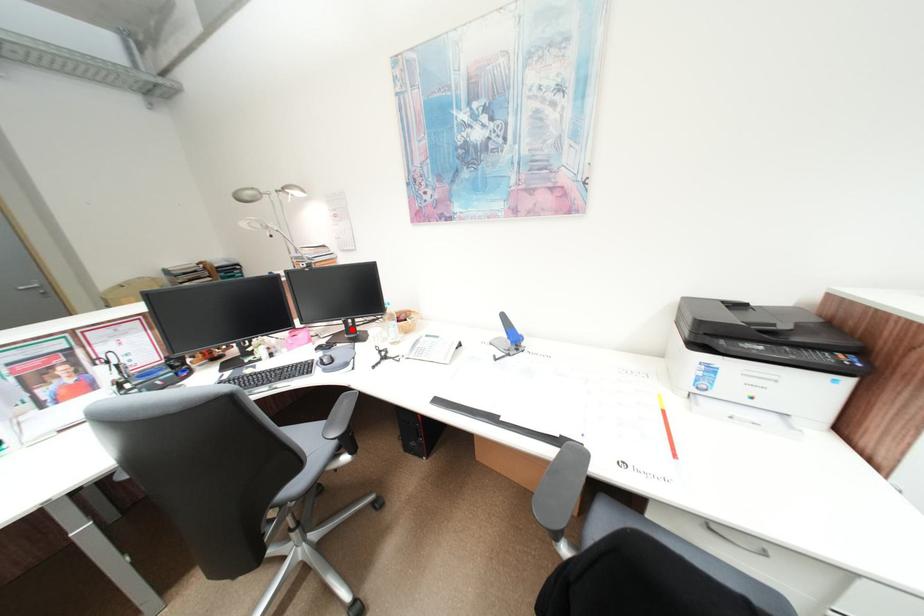
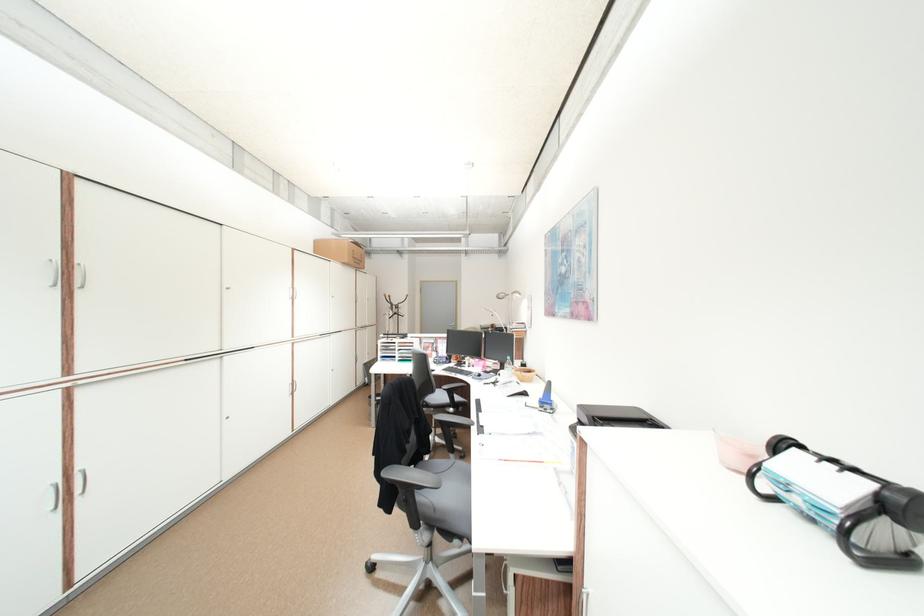
Question: I am providing you with two images of the same scene from different viewpoints. In image1, a red point is highlighted. Considering the same 3D point in image2, which of the following is correct?

Choices:
 (A) It is closer
 (B) It is farther

Answer: (B)